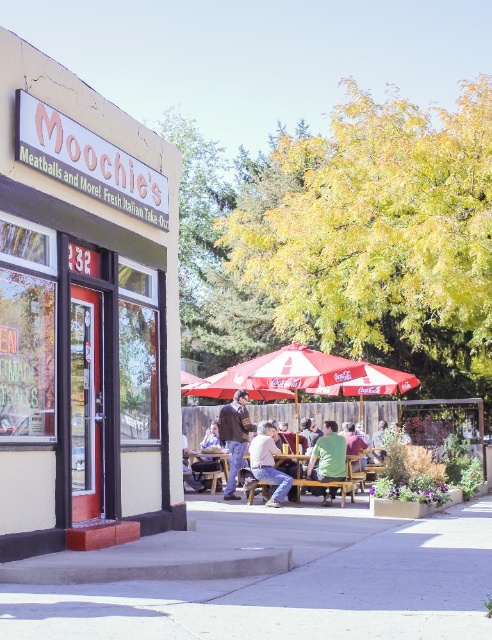
You are a customer trying to choose between wearing your light brown leather jacket at center or your green matte shirt at center to visit Moochie Italian restaurant. Which clothing item would you choose if you want to stand out more in the dining area?

The light brown leather jacket at center might be wider than green matte shirt at center, so it could make you stand out more due to its larger size.

You are a customer waiting at the dining area of Moochie. You see a light brown leather jacket at center and a wooden table at center. Which object is taller?

The light brown leather jacket at center is taller than the wooden table at center.